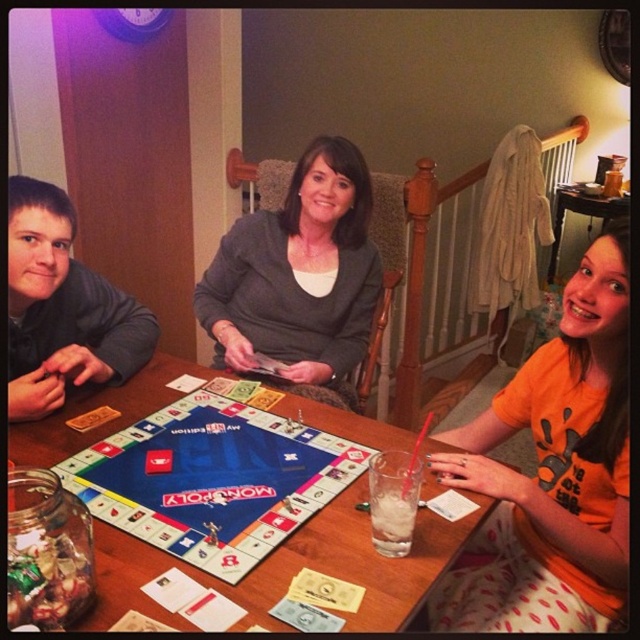
You are a waiter at a restaurant. You need to place a dessert plate between the gray sweater at center and the clear glass at table center. The plate is 12 inches in diameter. Will there be enough space between them to fit the plate without moving either item?

The gray sweater at center and clear glass at table center are 38.46 inches apart from each other. Since the dessert plate is 12 inches in diameter, there is sufficient space between them to fit the plate without moving either item.